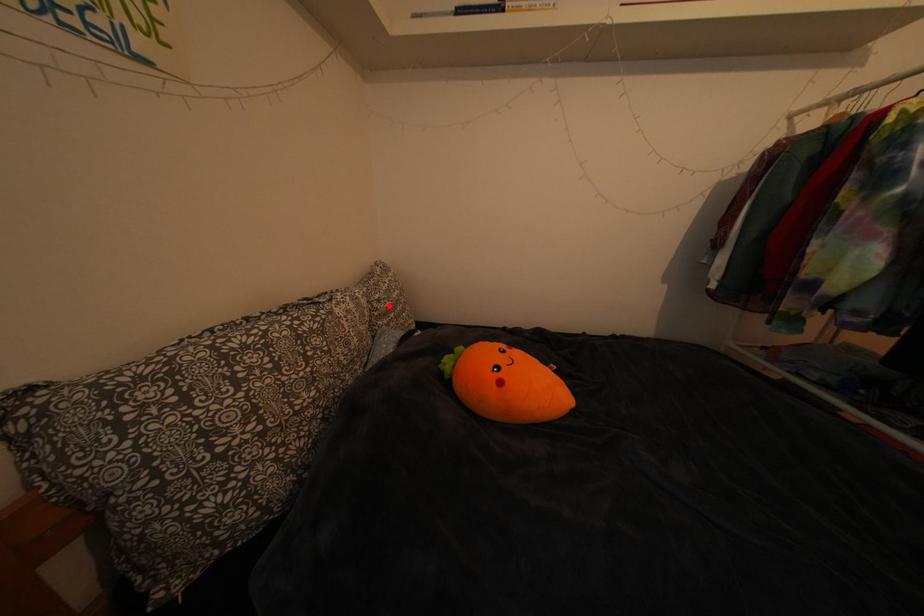
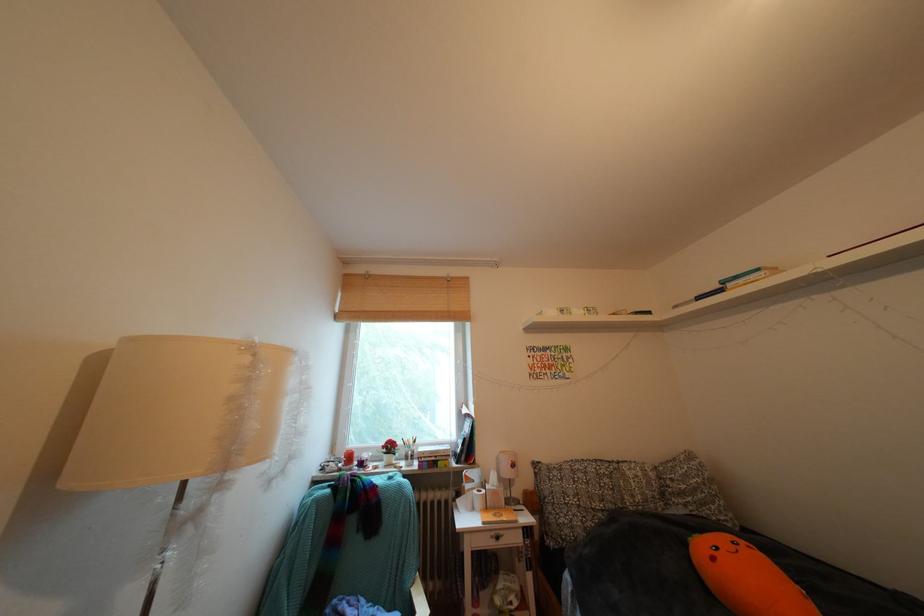
Question: I am providing you with two images of the same scene from different viewpoints. A red point is marked on the first image. Is the red point's position out of view in image 2?

Choices:
 (A) Yes
 (B) No

Answer: (B)